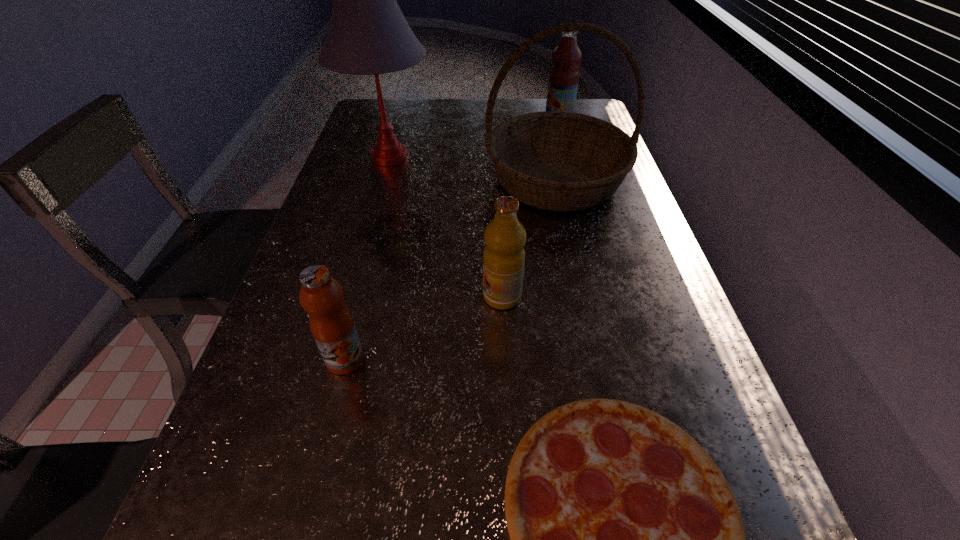
This screenshot has width=960, height=540. What are the coordinates of `basket located at the right edge` in the screenshot? It's located at (559, 161).

Identify the location of fruit juice present at the right edge. (564, 75).

I want to click on object that is positioned at the far right corner, so click(x=564, y=75).

You are a GUI agent. You are given a task and a screenshot of the screen. Output one action in this format:
    pyautogui.click(x=<x>, y=<y>)
    Task: Click on the vacant region at the far edge
    
    Given the screenshot: What is the action you would take?
    pyautogui.click(x=455, y=129)

At what (x,y) coordinates should I click in order to perform the action: click on blank space at the left edge. Please return your answer as a coordinate pair (x, y). Looking at the image, I should click on (219, 500).

Locate an element on the screen. The image size is (960, 540). blank space at the right edge of the desktop is located at coordinates 699,380.

Image resolution: width=960 pixels, height=540 pixels. Find the location of `free space between the table lamp and the fifth farthest object`. free space between the table lamp and the fifth farthest object is located at coordinates (367, 259).

Where is `free space between the second fruit juice from left to right and the farthest fruit juice`? Image resolution: width=960 pixels, height=540 pixels. free space between the second fruit juice from left to right and the farthest fruit juice is located at coordinates (531, 207).

This screenshot has height=540, width=960. What are the coordinates of `vacant region between the fifth farthest object and the basket` in the screenshot? It's located at (450, 270).

Identify the location of vacant area that lies between the fourth farthest object and the table lamp. The height and width of the screenshot is (540, 960). (445, 227).